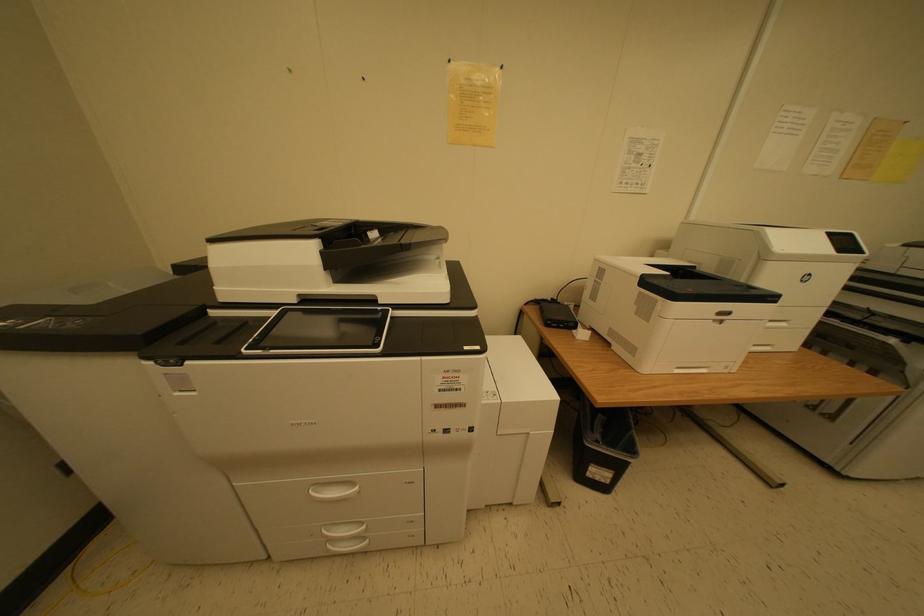
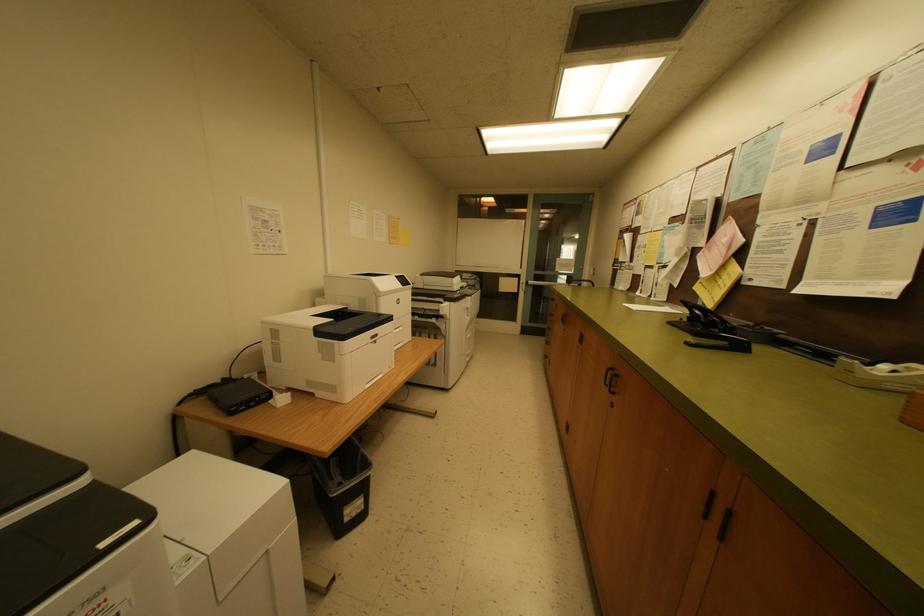
Question: The camera is either moving clockwise (left) or counter-clockwise (right) around the object. The first image is from the beginning of the video and the second image is from the end. Is the camera moving left or right when shooting the video?

Choices:
 (A) Left
 (B) Right

Answer: (A)